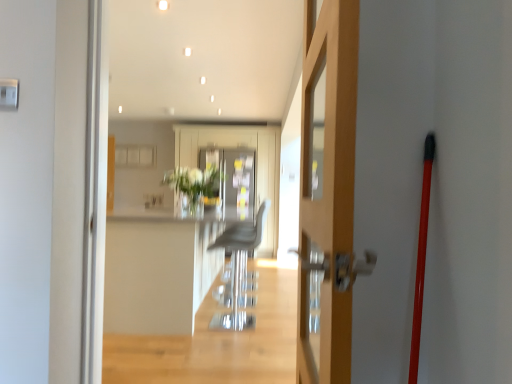
What do you see at coordinates (239, 268) in the screenshot?
I see `metallic gray armchair at center` at bounding box center [239, 268].

You are a GUI agent. You are given a task and a screenshot of the screen. Output one action in this format:
    pyautogui.click(x=<x>, y=<y>)
    Task: Click on the white glossy counter top at center
    The image size is (512, 384).
    Given the screenshot: What is the action you would take?
    [158, 272]

Describe the element at coordinates (158, 272) in the screenshot. I see `white glossy counter top at center` at that location.

The image size is (512, 384). What do you see at coordinates (327, 191) in the screenshot?
I see `wooden door at center` at bounding box center [327, 191].

Where is `metallic gray armchair at center`? The width and height of the screenshot is (512, 384). metallic gray armchair at center is located at coordinates pyautogui.click(x=239, y=268).

Considering the positions of points (315, 33) and (183, 196), is point (315, 33) closer to camera compared to point (183, 196)?

Yes, point (315, 33) is in front of point (183, 196).

Is wooden door at center positioned far away from translucent glass vase at center?

Yes, wooden door at center is far from translucent glass vase at center.

The height and width of the screenshot is (384, 512). I want to click on door that is under the translucent glass vase at center (from a real-world perspective), so click(327, 191).

Does wooden door at center turn towards white glossy counter top at center?

No, wooden door at center is not aimed at white glossy counter top at center.

Is point (333, 328) closer to viewer compared to point (183, 296)?

That is True.

Does wooden door at center have a lesser height compared to white glossy counter top at center?

In fact, wooden door at center may be taller than white glossy counter top at center.

How different are the orientations of wooden door at center and white glossy counter top at center in degrees?

wooden door at center and white glossy counter top at center are facing 180 degrees away from each other.

Is translucent glass vase at center oriented towards metallic gray armchair at center?

No, translucent glass vase at center is not oriented towards metallic gray armchair at center.

Is translucent glass vase at center positioned in front of metallic gray armchair at center?

No, translucent glass vase at center is further to the viewer.

Which is more to the right, translucent glass vase at center or metallic gray armchair at center?

Positioned to the right is metallic gray armchair at center.

From a real-world perspective, between translucent glass vase at center and metallic gray armchair at center, who is vertically higher?

translucent glass vase at center is physically above.

From the image's perspective, relative to translucent glass vase at center, is white glossy counter top at center above or below?

Based on their image positions, white glossy counter top at center is located beneath translucent glass vase at center.

Find the location of a particular element. counter top located on the left of translucent glass vase at center is located at coordinates pos(158,272).

Is white glossy counter top at center wider or thinner than translucent glass vase at center?

In the image, white glossy counter top at center appears to be wider than translucent glass vase at center.

Could translucent glass vase at center be considered to be inside white glossy counter top at center?

That's incorrect, translucent glass vase at center is not inside white glossy counter top at center.

Is metallic gray armchair at center facing towards translucent glass vase at center?

No.

Between metallic gray armchair at center and translucent glass vase at center, which one has smaller width?

Thinner between the two is metallic gray armchair at center.

The image size is (512, 384). What are the coordinates of `plant on the left side of metallic gray armchair at center` in the screenshot? It's located at (193, 186).

In the scene shown: Between metallic gray armchair at center and translucent glass vase at center, which one is positioned behind?

translucent glass vase at center is behind.

Is point (221, 319) more distant than point (125, 276)?

Yes, it is behind point (125, 276).

Is metallic gray armchair at center completely or partially outside of white glossy counter top at center?

No, most part of metallic gray armchair at center lies within white glossy counter top at center.

Is metallic gray armchair at center touching white glossy counter top at center?

No, metallic gray armchair at center is not making contact with white glossy counter top at center.

Is white glossy counter top at center situated inside metallic gray armchair at center or outside?

white glossy counter top at center is outside metallic gray armchair at center.

Is white glossy counter top at center aimed at metallic gray armchair at center?

Yes, white glossy counter top at center is facing metallic gray armchair at center.

Consider the image. Are white glossy counter top at center and metallic gray armchair at center located far from each other?

white glossy counter top at center is near metallic gray armchair at center, not far away.

From the image's perspective, which is above, white glossy counter top at center or metallic gray armchair at center?

metallic gray armchair at center.

The image size is (512, 384). In order to click on door located underneath the translucent glass vase at center (from a real-world perspective) in this screenshot , I will do `click(327, 191)`.

At what (x,y) coordinates should I click in order to perform the action: click on door above the white glossy counter top at center (from the image's perspective). Please return your answer as a coordinate pair (x, y). This screenshot has height=384, width=512. Looking at the image, I should click on (327, 191).

Estimate the real-world distances between objects in this image. Which object is further from white glossy counter top at center, metallic gray armchair at center or wooden door at center?

wooden door at center lies further to white glossy counter top at center than the other object.

Estimate the real-world distances between objects in this image. Which object is further from translucent glass vase at center, white glossy counter top at center or wooden door at center?

Among the two, wooden door at center is located further to translucent glass vase at center.

Estimate the real-world distances between objects in this image. Which object is closer to metallic gray armchair at center, wooden door at center or white glossy counter top at center?

The object closer to metallic gray armchair at center is white glossy counter top at center.

When comparing their distances from translucent glass vase at center, does white glossy counter top at center or metallic gray armchair at center seem closer?

white glossy counter top at center is closer to translucent glass vase at center.

Looking at the image, which one is located further to metallic gray armchair at center, translucent glass vase at center or wooden door at center?

wooden door at center lies further to metallic gray armchair at center than the other object.

Looking at the image, which one is located further to metallic gray armchair at center, wooden door at center or translucent glass vase at center?

wooden door at center is positioned further to the anchor metallic gray armchair at center.

Which object lies nearer to the anchor point wooden door at center, metallic gray armchair at center or white glossy counter top at center?

Based on the image, white glossy counter top at center appears to be nearer to wooden door at center.

Estimate the real-world distances between objects in this image. Which object is closer to translucent glass vase at center, metallic gray armchair at center or wooden door at center?

Among the two, metallic gray armchair at center is located nearer to translucent glass vase at center.

Find the location of a particular element. The image size is (512, 384). counter top positioned between wooden door at center and metallic gray armchair at center from near to far is located at coordinates (158, 272).

Find the location of a particular element. Image resolution: width=512 pixels, height=384 pixels. armchair between translucent glass vase at center and white glossy counter top at center vertically is located at coordinates (239, 268).

You are a GUI agent. You are given a task and a screenshot of the screen. Output one action in this format:
    pyautogui.click(x=<x>, y=<y>)
    Task: Click on the armchair between wooden door at center and translucent glass vase at center along the z-axis
    This screenshot has height=384, width=512.
    Given the screenshot: What is the action you would take?
    pyautogui.click(x=239, y=268)

Identify the location of counter top between wooden door at center and translucent glass vase at center in the front-back direction. The width and height of the screenshot is (512, 384). (158, 272).